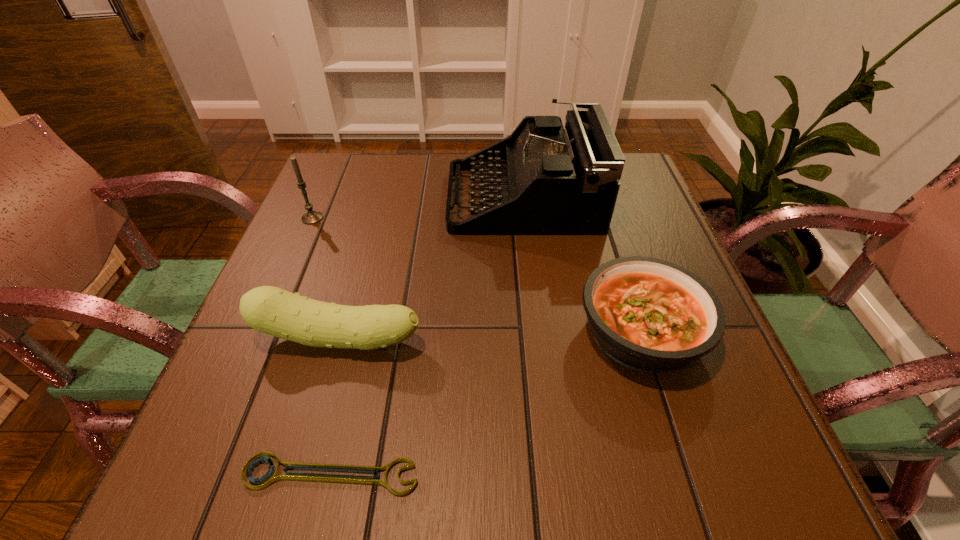
Find the location of `typewriter`. typewriter is located at coordinates (549, 180).

Where is `the second tallest object`? the second tallest object is located at coordinates (311, 217).

You are a GUI agent. You are given a task and a screenshot of the screen. Output one action in this format:
    pyautogui.click(x=<x>, y=<y>)
    Task: Click on the third shortest object
    The width and height of the screenshot is (960, 540).
    Given the screenshot: What is the action you would take?
    pyautogui.click(x=271, y=310)

Where is `the second shortest object`? the second shortest object is located at coordinates (650, 315).

This screenshot has width=960, height=540. I want to click on the nearest object, so click(270, 477).

The image size is (960, 540). Identify the location of wrench. (270, 477).

At what (x,y) coordinates should I click in order to perform the action: click on free region located on the typing side of the typewriter. Please return your answer as a coordinate pair (x, y). The height and width of the screenshot is (540, 960). Looking at the image, I should click on (352, 198).

Locate an element on the screen. free region located 0.310m on the typing side of the typewriter is located at coordinates (324, 198).

Find the location of a particular element. This screenshot has width=960, height=540. vacant space located on the typing side of the typewriter is located at coordinates (361, 198).

What are the coordinates of `free space located on the right of the candle` in the screenshot? It's located at (467, 218).